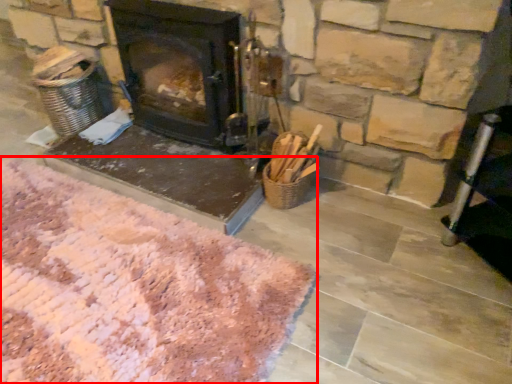
Question: From the image's perspective, what is the correct spatial relationship of mat (annotated by the red box) in relation to wood burning stove?

Choices:
 (A) below
 (B) above

Answer: (A)